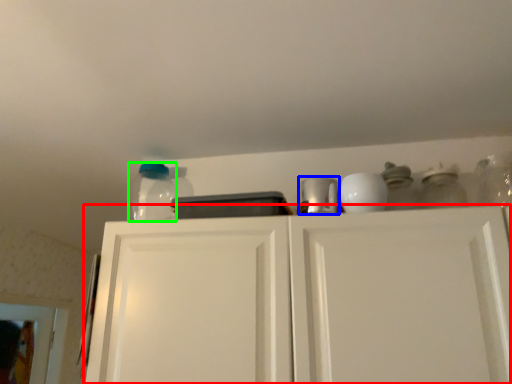
Question: Estimate the real-world distances between objects in this image. Which object is closer to cabinetry (highlighted by a red box), appliance (highlighted by a blue box) or glass jar (highlighted by a green box)?

Choices:
 (A) appliance
 (B) glass jar

Answer: (A)